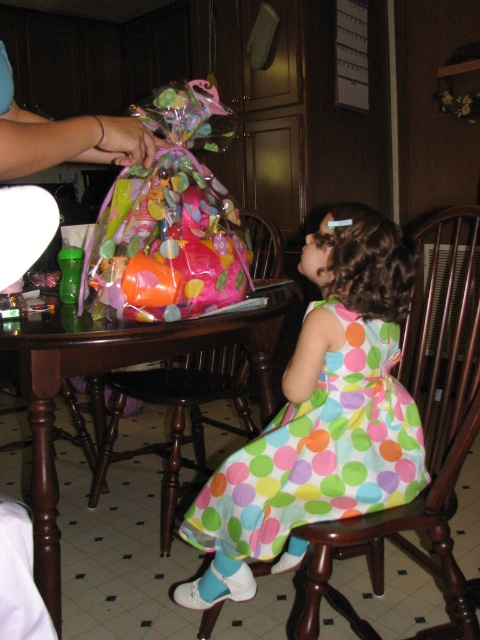
You are a parent trying to place a rectangular gift box that is 1.2 meters long on the dark wood table at center. The wooden chair at right is currently occupying some space. Can you place the gift box horizontally on the table without moving the chair?

The wooden chair at right is positioned on the right side of dark wood table at center. Since the table is dark wood and the chair is on the right, there might be enough space to place the gift box horizontally, but the exact dimensions of the table aren

You are a guest at a birthday party and see the multicolored polka dot dress at lower center and the wooden chair at right. Which object is closer to the floor?

The multicolored polka dot dress at lower center is closer to the floor because it is below the wooden chair at right.

You are a photographer setting up a shoot in this room. You need to ensure that the multicolored polka dot dress at lower center and the wooden chair at right are both visible in the frame. Given their sizes, which object should you place closer to the camera to maintain their visibility?

Since the multicolored polka dot dress at lower center is smaller than the wooden chair at right, you should place the multicolored polka dot dress at lower center closer to the camera to ensure both objects are visible in the frame.